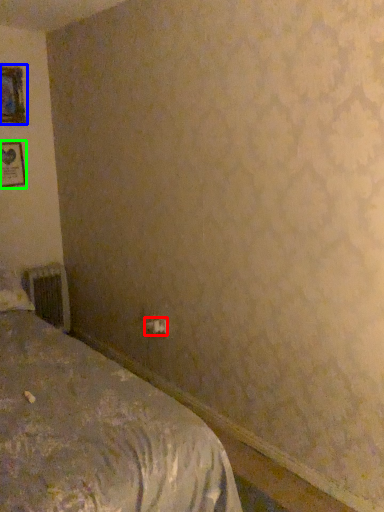
Question: Which is nearer to the electric outlet (highlighted by a red box)? picture frame (highlighted by a blue box) or picture frame (highlighted by a green box).

Choices:
 (A) picture frame
 (B) picture frame

Answer: (B)